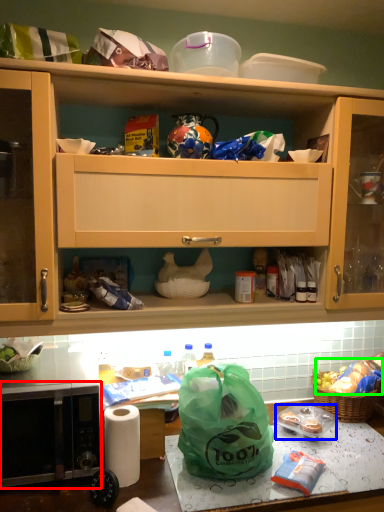
Question: Which is nearer to the microwave oven (highlighted by a red box)? food (highlighted by a blue box) or food (highlighted by a green box).

Choices:
 (A) food
 (B) food

Answer: (A)